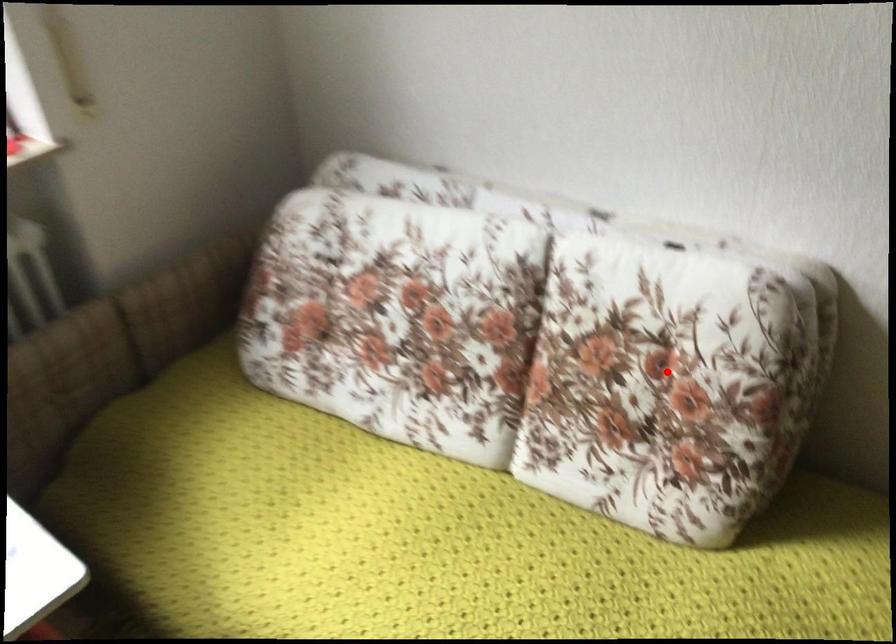
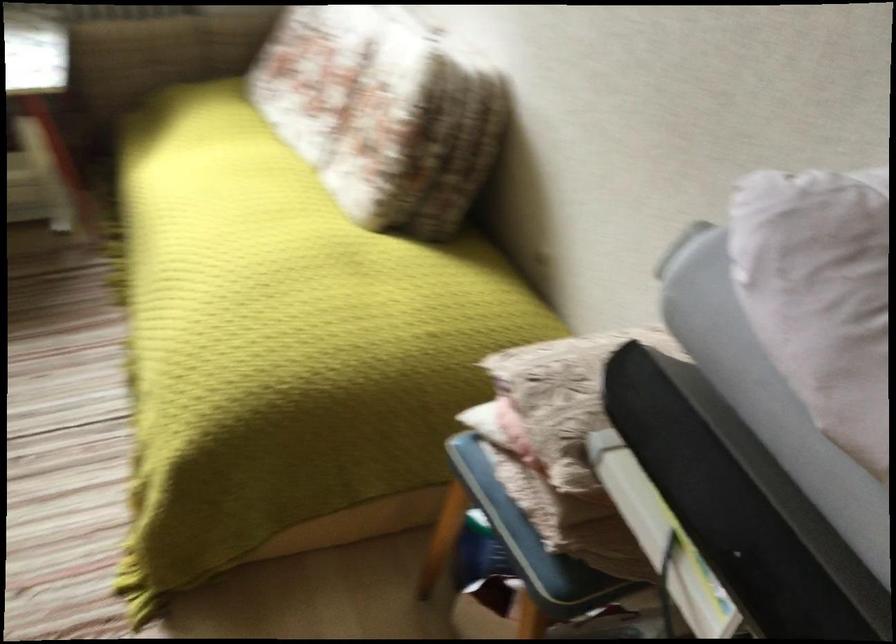
Question: A red point is marked in image1. In image2, is the corresponding 3D point closer to the camera or farther? Reply with the corresponding letter.

Choices:
 (A) The corresponding 3D point is closer.
 (B) The corresponding 3D point is farther.

Answer: (B)